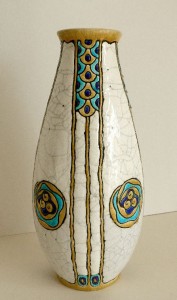
Find the location of a particular element. middle vertical line on vase is located at coordinates (88, 207).